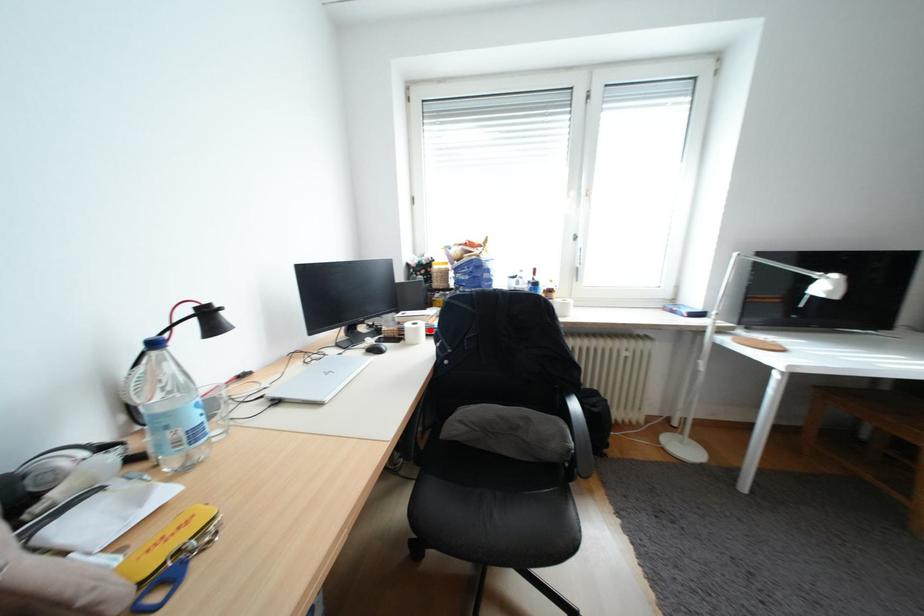
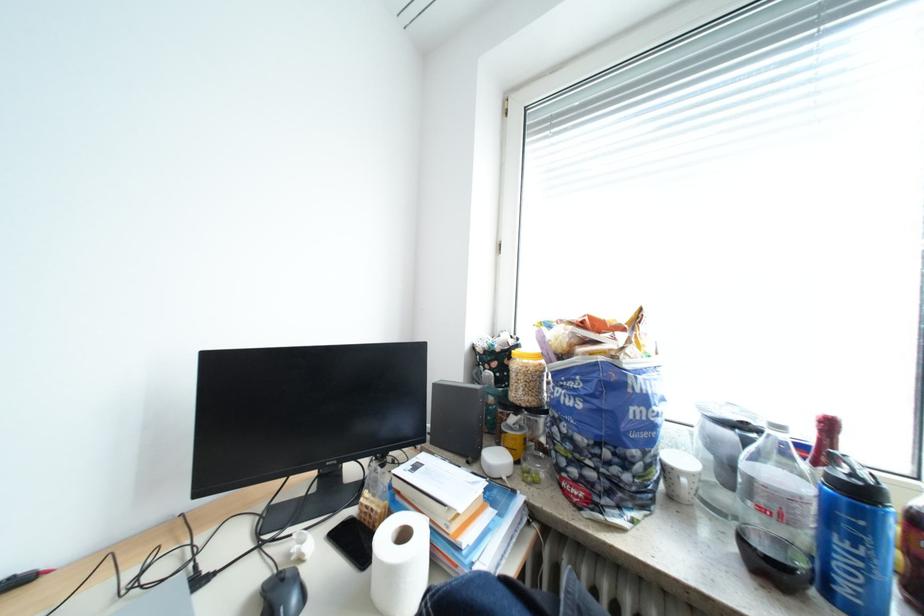
Locate, in the second image, the point that corresponds to the highlighted location in the first image.

(404, 573)